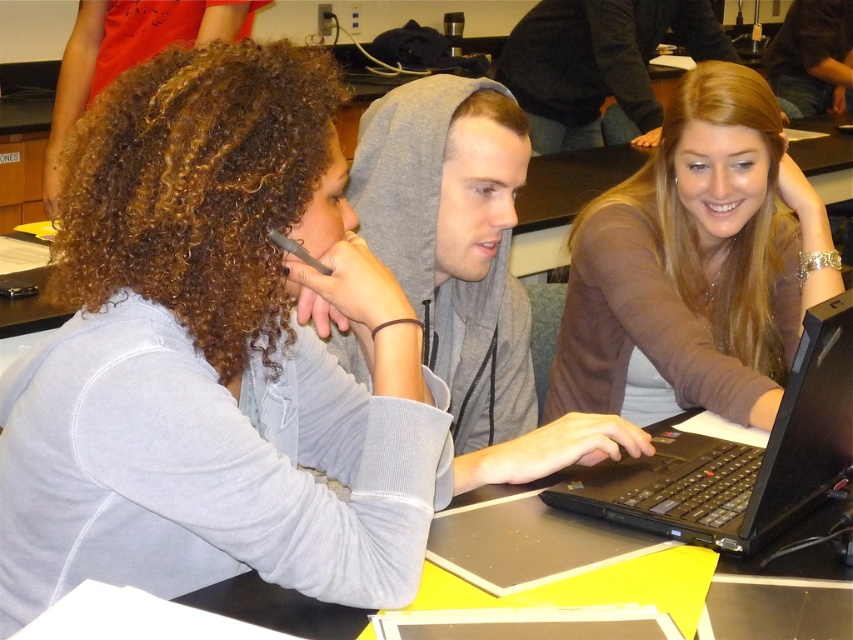
You are a student who needs to reach the black matte laptop at lower right to grab a USB drive from its side. The matte brown sweater at center is blocking your path. Can you easily access the laptop without moving the sweater?

The black matte laptop at lower right is behind the matte brown sweater at center, so you cannot easily access it without moving the sweater.

You are a photographer trying to capture a group photo of the three people at the table. Since you want to ensure that the gray hoodie at center and the black matte laptop at lower right are both clearly visible in the frame, which object should you prioritize positioning closer to the camera to avoid being cut off?

The gray hoodie at center should be positioned closer to the camera because it is larger than the black matte laptop at lower right, making it more likely to be cut off if placed further away.

What is the color and type of clothing item located at the coordinate point (694, 260) in the image?

The point at coordinate (694, 260) corresponds to a matte brown sweater at center.